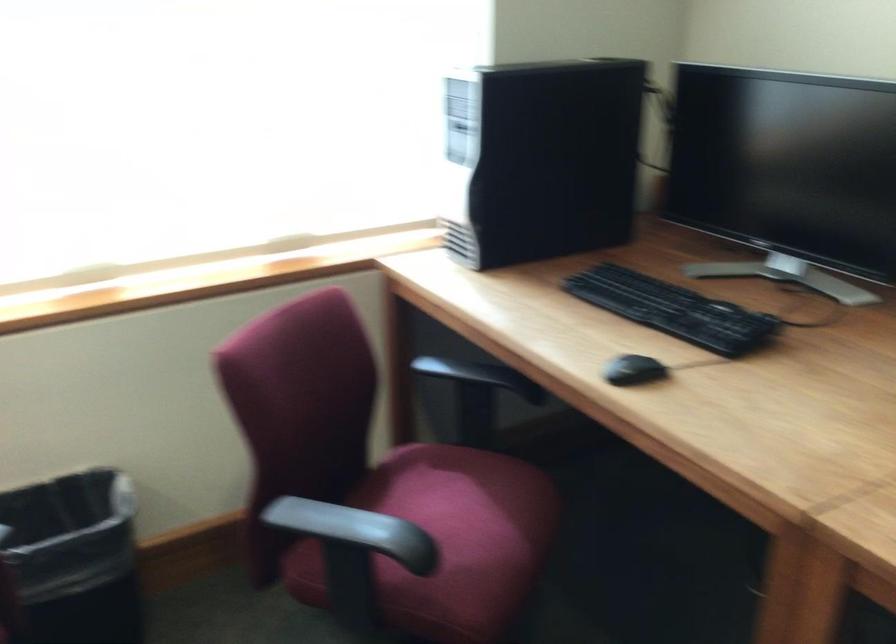
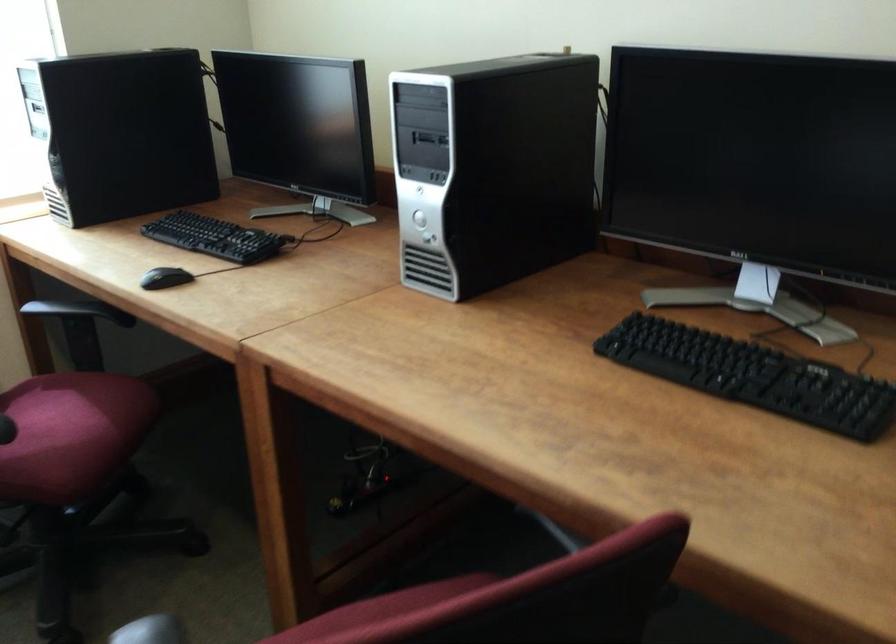
Where in the second image is the point corresponding to [633,368] from the first image?

(165, 278)